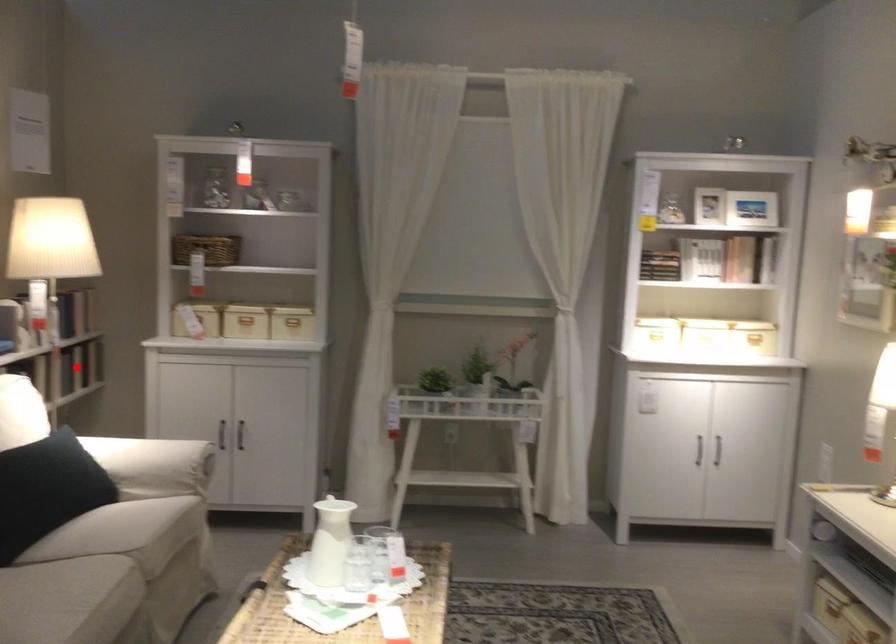
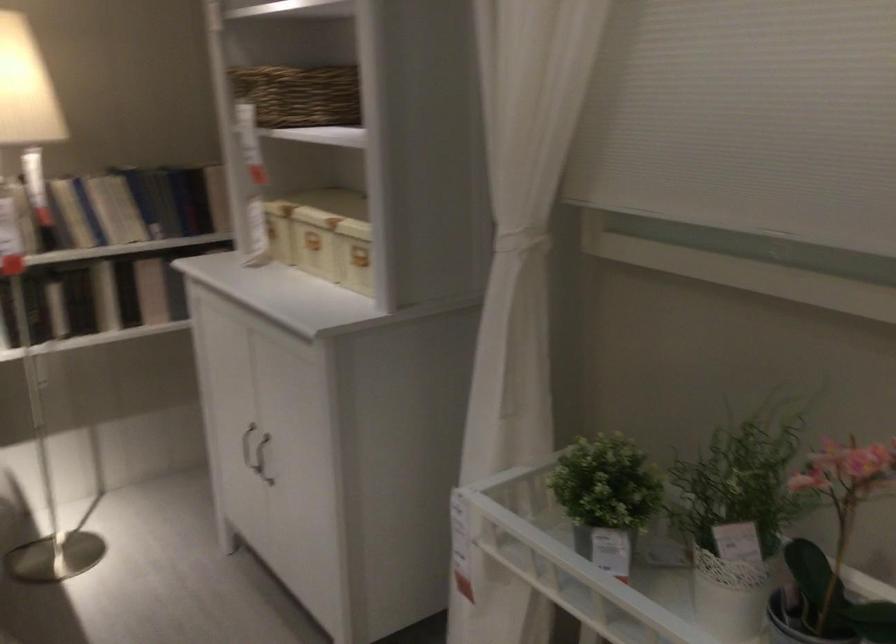
Question: I am providing you with two images of the same scene from different viewpoints. In image1, a red point is highlighted. Considering the same 3D point in image2, which of the following is correct?

Choices:
 (A) It is closer
 (B) It is farther

Answer: (A)